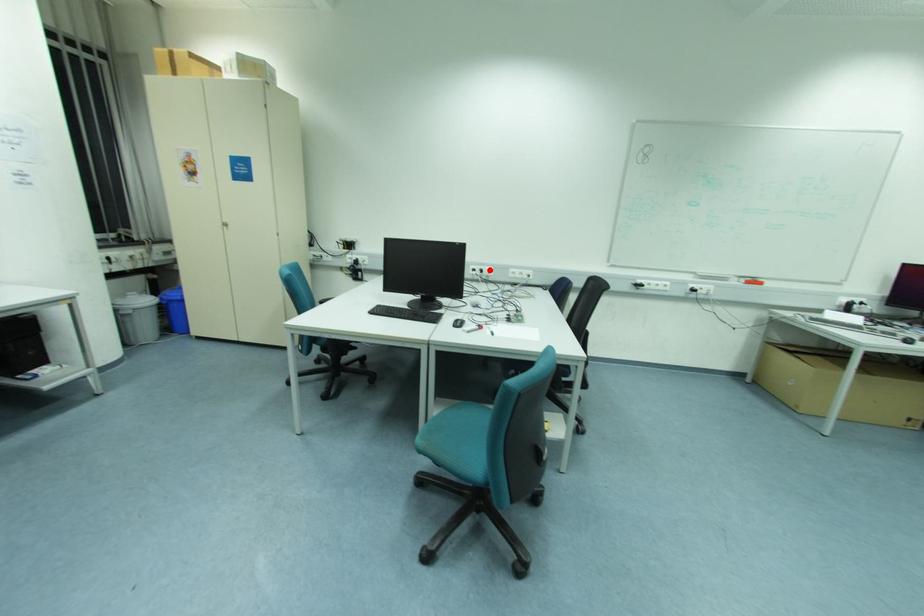
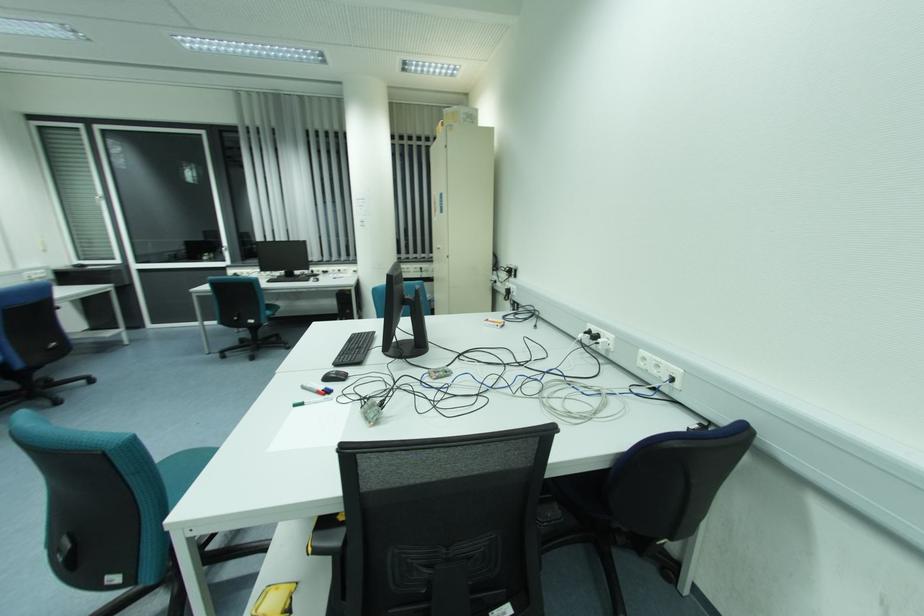
In the second image, find the point that corresponds to the highlighted location in the first image.

(608, 339)